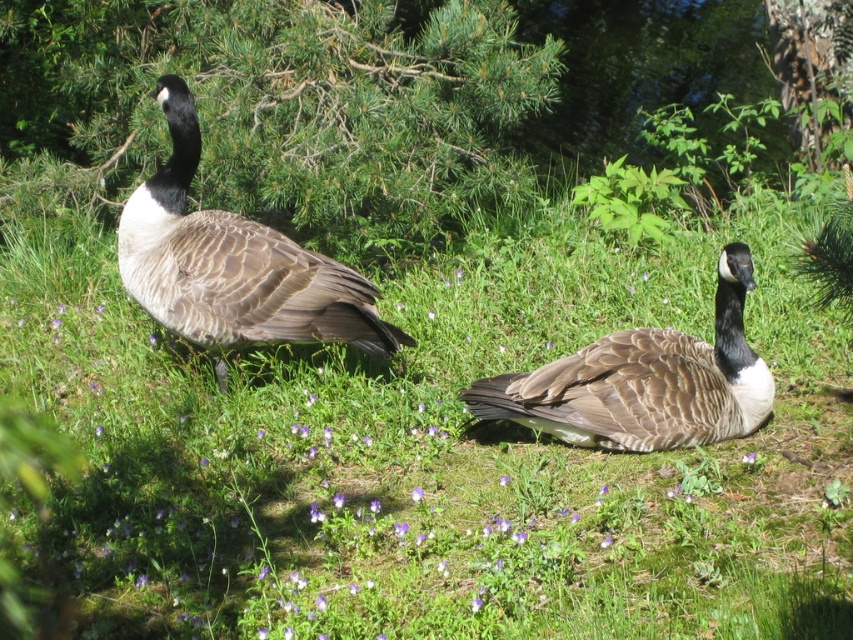
You are a photographer trying to capture a closeup of the brown feathered goose at center. However, the brown textured grass at center is blocking your view. Can you determine which object is closer to you based on the scene?

The brown textured grass at center is closer to the viewer than the brown feathered goose at center, so the grass is blocking your view of the goose.